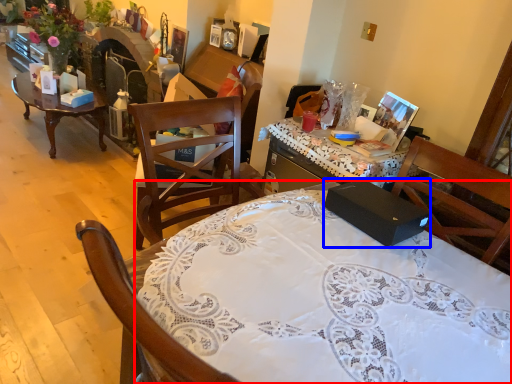
Question: Which object appears farthest to the camera in this image, desk (highlighted by a red box) or box (highlighted by a blue box)?

Choices:
 (A) desk
 (B) box

Answer: (B)